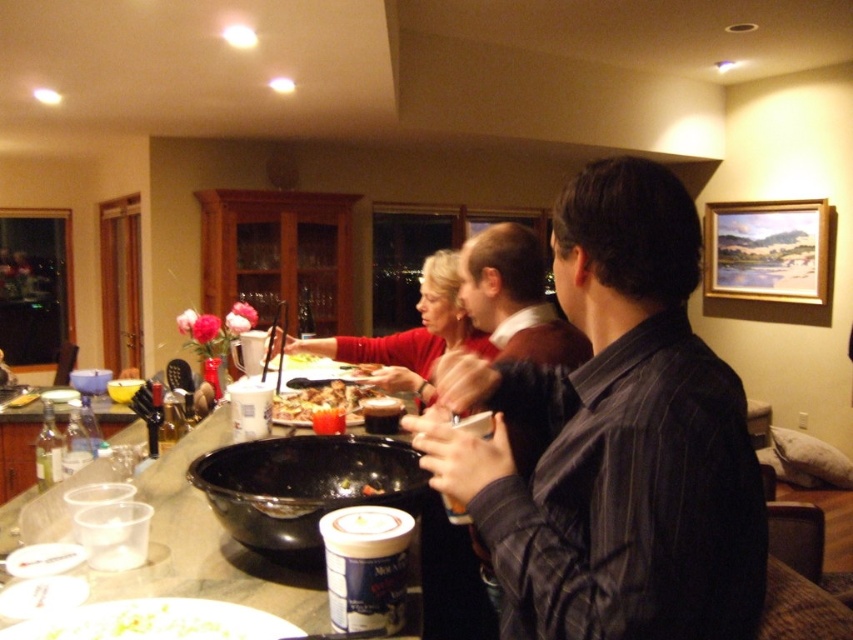
Can you confirm if dark gray striped shirt at center is thinner than black glossy bowl at center?

No, dark gray striped shirt at center is not thinner than black glossy bowl at center.

Who is more forward, (x=550, y=378) or (x=297, y=525)?

Point (x=297, y=525) is more forward.

Identify the location of dark gray striped shirt at center. This screenshot has height=640, width=853. (614, 438).

Does matte red sweater at center have a larger size compared to clear glass bottle at counter left?

Indeed, matte red sweater at center has a larger size compared to clear glass bottle at counter left.

Does matte red sweater at center have a greater height compared to clear glass bottle at counter left?

Yes.

Does point (387, 360) come farther from viewer compared to point (39, 464)?

Yes.

Find the location of a particular element. Image resolution: width=853 pixels, height=640 pixels. matte red sweater at center is located at coordinates (409, 336).

Who is shorter, black glossy bowl at center or matte red sweater at center?

Standing shorter between the two is black glossy bowl at center.

The height and width of the screenshot is (640, 853). In order to click on black glossy bowl at center in this screenshot , I will do `click(303, 486)`.